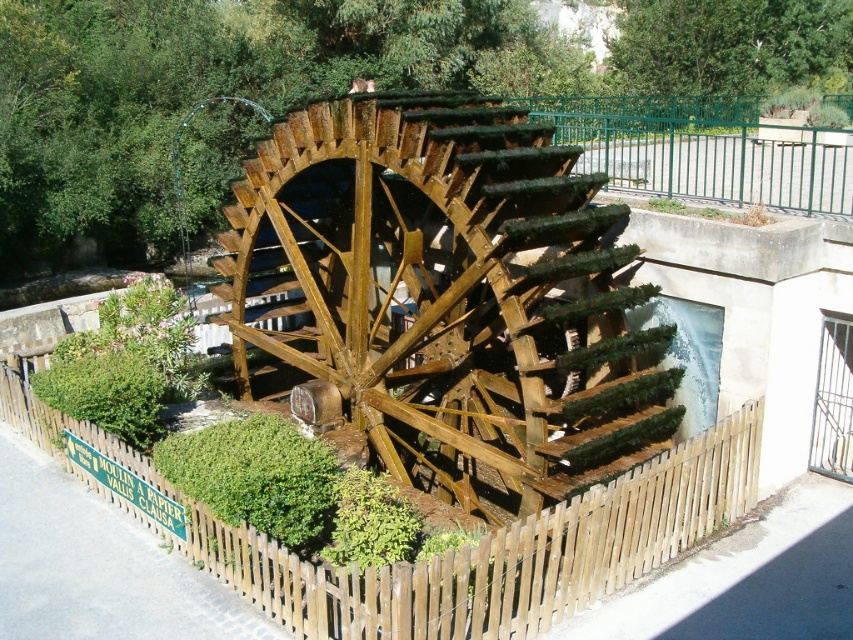
Between wooden waterwheel at center and brown wooden fence at lower center, which one has less height?

With less height is wooden waterwheel at center.

Between point (242, 317) and point (346, 596), which one is positioned in front?

Point (346, 596) is more forward.

Find the location of a particular element. The width and height of the screenshot is (853, 640). wooden waterwheel at center is located at coordinates (445, 298).